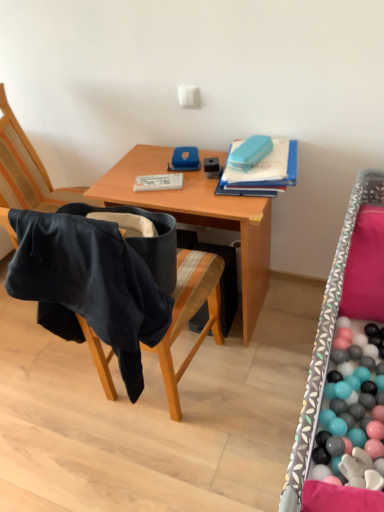
Find the location of `vacant region under black fabric chair at left (from a real-world perspective)`. vacant region under black fabric chair at left (from a real-world perspective) is located at coordinates (161, 391).